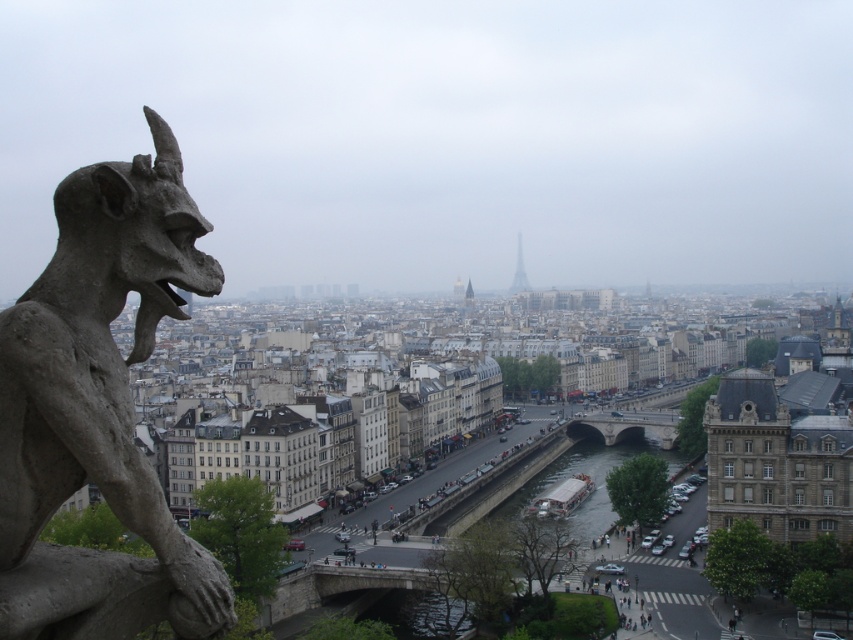
Question: Can you confirm if gray stone gargoyle at left is positioned to the left of metallic silver tower at center?

Choices:
 (A) no
 (B) yes

Answer: (B)

Question: Does gray stone gargoyle at left appear over metallic silver tower at center?

Choices:
 (A) no
 (B) yes

Answer: (A)

Question: Which point appears farthest from the camera in this image?

Choices:
 (A) (137, 241)
 (B) (518, 244)

Answer: (B)

Question: Does gray stone gargoyle at left have a lesser width compared to metallic silver tower at center?

Choices:
 (A) yes
 (B) no

Answer: (A)